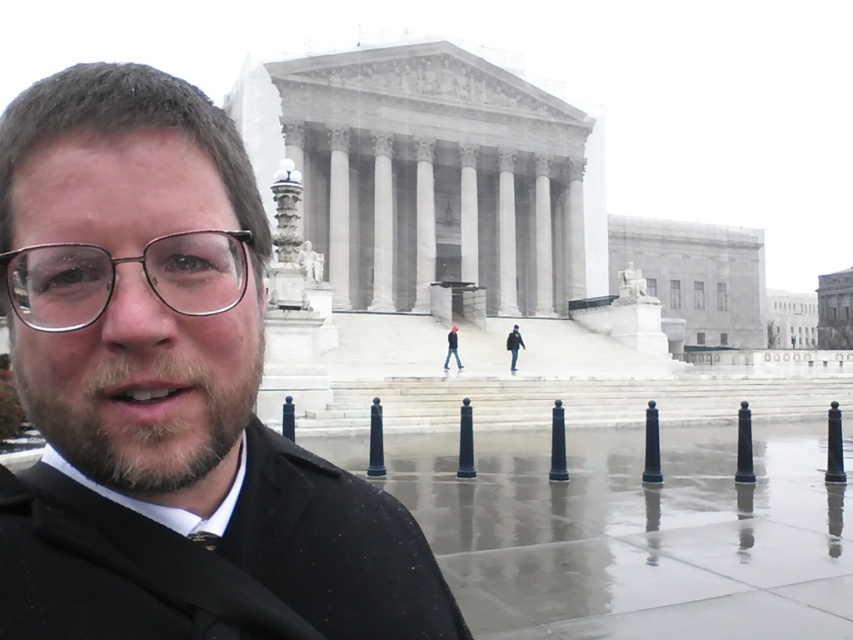
Question: In this image, where is brown fuzzy beard at center located relative to metal/transparent glasses at center?

Choices:
 (A) below
 (B) above

Answer: (A)

Question: Among these objects, which one is nearest to the camera?

Choices:
 (A) light brown leather jacket at center
 (B) metal/transparent glasses at center

Answer: (B)

Question: Does black matte coat at center have a larger size compared to light brown leather jacket at center?

Choices:
 (A) yes
 (B) no

Answer: (A)

Question: Is black matte coat at center thinner than brown fuzzy beard at center?

Choices:
 (A) yes
 (B) no

Answer: (B)

Question: Which of the following is the closest to the observer?

Choices:
 (A) light brown leather jacket at center
 (B) brown fuzzy beard at center
 (C) dark gray jacket at center
 (D) black matte coat at center

Answer: (D)

Question: Which object is closer to the camera taking this photo?

Choices:
 (A) dark gray jacket at center
 (B) metal/transparent glasses at center
 (C) black matte coat at center
 (D) light brown leather jacket at center

Answer: (C)